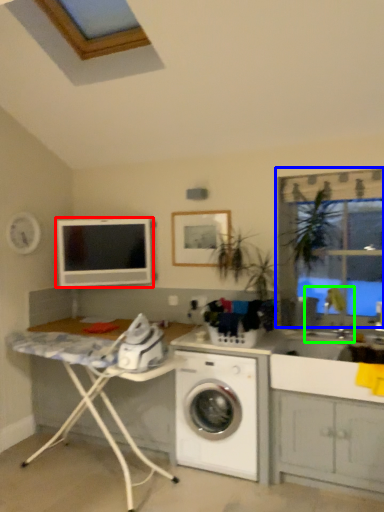
Question: Based on their relative distances, which object is farther from computer monitor (highlighted by a red box)? Choose from window frame (highlighted by a blue box) and sink (highlighted by a green box).

Choices:
 (A) window frame
 (B) sink

Answer: (B)